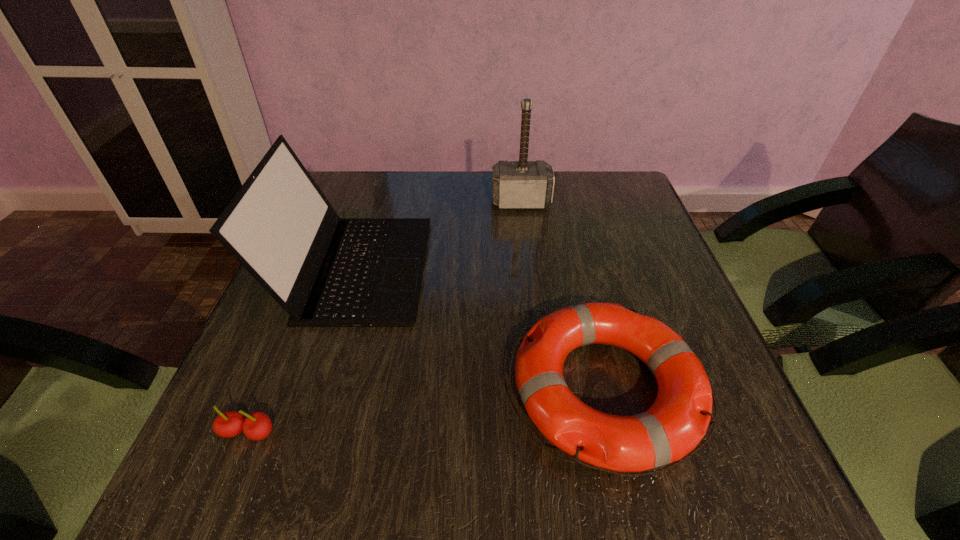
Identify the location of cherry present at the near edge. The height and width of the screenshot is (540, 960). (256, 426).

Locate an element on the screen. This screenshot has width=960, height=540. laptop that is at the left edge is located at coordinates (325, 271).

This screenshot has width=960, height=540. What are the coordinates of `cherry situated at the left edge` in the screenshot? It's located at (256, 426).

Locate an element on the screen. This screenshot has height=540, width=960. object at the right edge is located at coordinates (673, 426).

You are a GUI agent. You are given a task and a screenshot of the screen. Output one action in this format:
    pyautogui.click(x=<x>, y=<y>)
    Task: Click on the object that is at the near left corner
    
    Given the screenshot: What is the action you would take?
    pyautogui.click(x=256, y=426)

Locate an element on the screen. This screenshot has height=540, width=960. object at the near right corner is located at coordinates (673, 426).

Find the location of a particular element. free space at the far edge of the desktop is located at coordinates pos(387,205).

In order to click on vacant space at the near edge in this screenshot , I will do `click(480, 487)`.

Find the location of `vacant space at the right edge`. vacant space at the right edge is located at coordinates (628, 255).

This screenshot has width=960, height=540. I want to click on vacant space at the far left corner of the desktop, so click(x=376, y=184).